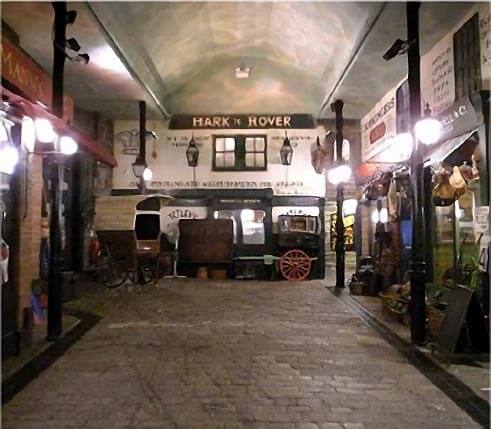
At what (x,y) coordinates should I click in order to perform the action: click on two pots on ground below crates. Please return your answer as a coordinate pair (x, y). This screenshot has width=491, height=429. Looking at the image, I should click on (221, 274), (204, 274).